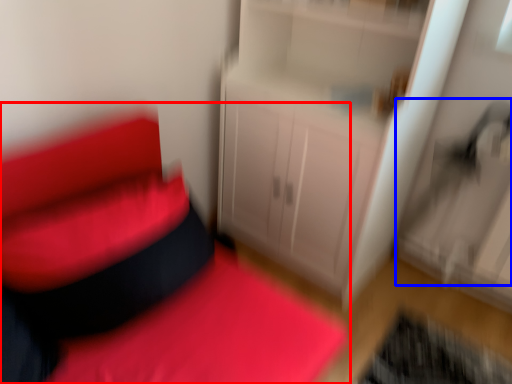
Question: Among these objects, which one is farthest to the camera, furniture (highlighted by a red box) or swivel chair (highlighted by a blue box)?

Choices:
 (A) furniture
 (B) swivel chair

Answer: (B)